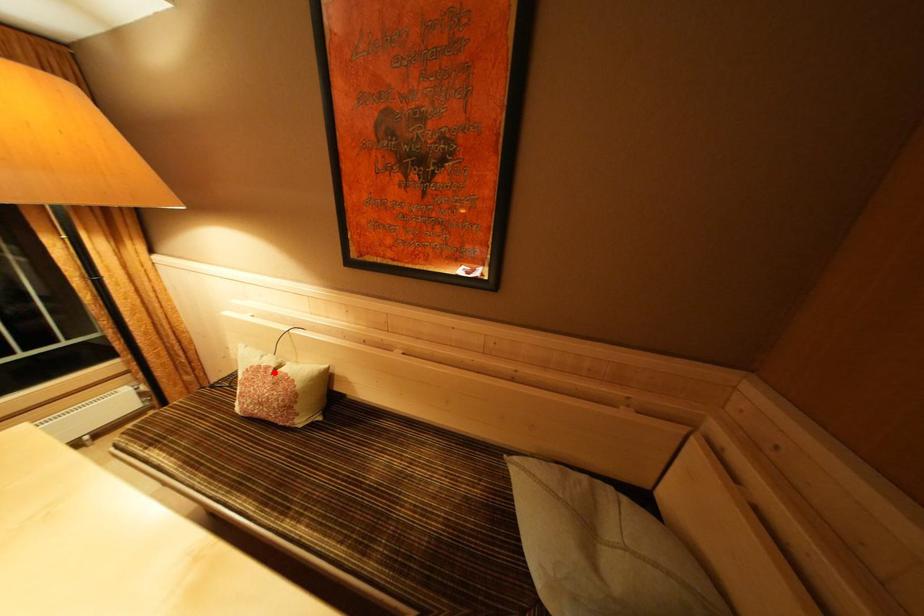
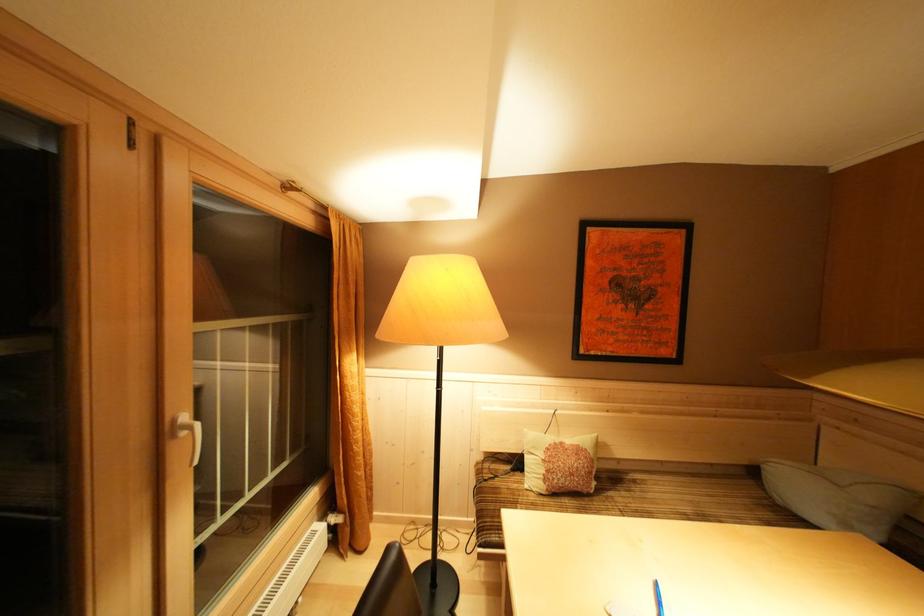
The point at the highlighted location is marked in the first image. Where is the corresponding point in the second image?

(568, 448)